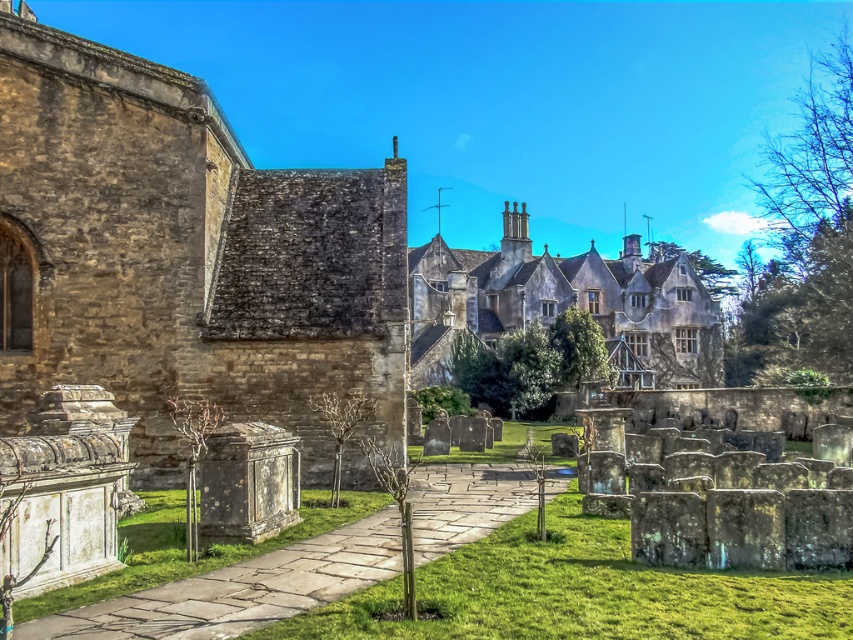
Question: Which of the following is the closest to the observer?

Choices:
 (A) (527, 224)
 (B) (602, 545)
 (C) (270, 195)

Answer: (B)

Question: Does brown stone church at left come in front of smooth gray stone gravestone at lower left?

Choices:
 (A) yes
 (B) no

Answer: (B)

Question: Among these objects, which one is nearest to the camera?

Choices:
 (A) green grass at center
 (B) brown stone church at left
 (C) smooth gray stone gravestone at lower left
 (D) green grass at lower left

Answer: (A)

Question: Can you confirm if brown stone church at left is positioned below stone gray stone building at center?

Choices:
 (A) yes
 (B) no

Answer: (B)

Question: Can you confirm if green grass at center is positioned to the right of green grass at lower left?

Choices:
 (A) yes
 (B) no

Answer: (A)

Question: Which point is farther from the camera taking this photo?

Choices:
 (A) (96, 595)
 (B) (395, 611)

Answer: (A)